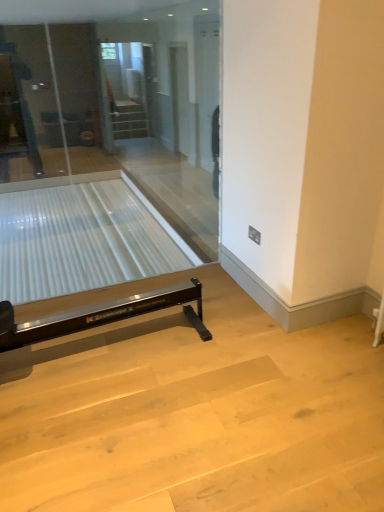
Measure the distance between transparent glass door at center and camera.

A distance of 4.11 meters exists between transparent glass door at center and camera.

Describe the element at coordinates (82, 238) in the screenshot. This screenshot has width=384, height=512. I see `clear glass table at lower left` at that location.

Locate an element on the screen. The height and width of the screenshot is (512, 384). transparent glass door at center is located at coordinates (107, 148).

Considering the sizes of objects transparent glass door at center and clear glass table at lower left in the image provided, who is taller, transparent glass door at center or clear glass table at lower left?

Standing taller between the two is transparent glass door at center.

Does point (123, 105) lie in front of point (176, 263)?

No, it is behind (176, 263).

From a real-world perspective, relative to clear glass table at lower left, is transparent glass door at center vertically above or below?

Clearly, from a real-world perspective, transparent glass door at center is above clear glass table at lower left.

Where is `glass door above the clear glass table at lower left (from the image's perspective)`? This screenshot has height=512, width=384. glass door above the clear glass table at lower left (from the image's perspective) is located at coordinates (107, 148).

Which is closer, (147, 117) or (199, 102)?

Point (147, 117) is positioned farther from the camera compared to point (199, 102).

Is clear glass screen door at upper center further to camera compared to transparent glass door at center?

Yes, it is behind transparent glass door at center.

Is clear glass screen door at upper center facing away from transparent glass door at center?

clear glass screen door at upper center is not turned away from transparent glass door at center.

From a real-world perspective, which is physically above, clear glass screen door at upper center or transparent glass door at center?

transparent glass door at center.

Does clear glass screen door at upper center have a greater width compared to clear glass table at lower left?

No.

How distant is clear glass screen door at upper center from clear glass table at lower left?

A distance of 8.60 feet exists between clear glass screen door at upper center and clear glass table at lower left.

Considering the positions of objects clear glass screen door at upper center and clear glass table at lower left in the image provided, who is more to the right, clear glass screen door at upper center or clear glass table at lower left?

clear glass screen door at upper center.

From a real-world perspective, is clear glass screen door at upper center physically located above or below clear glass table at lower left?

From a real-world perspective, clear glass screen door at upper center is physically above clear glass table at lower left.

From a real-world perspective, is clear glass table at lower left positioned above or below transparent glass door at center?

Clearly, from a real-world perspective, clear glass table at lower left is below transparent glass door at center.

Is clear glass table at lower left with transparent glass door at center?

No, clear glass table at lower left is not touching transparent glass door at center.

Which object is more forward, clear glass table at lower left or transparent glass door at center?

Positioned in front is transparent glass door at center.

Considering the relative positions of clear glass table at lower left and transparent glass door at center in the image provided, is clear glass table at lower left to the left of transparent glass door at center from the viewer's perspective?

Correct, you'll find clear glass table at lower left to the left of transparent glass door at center.

Consider the image. Is clear glass table at lower left aimed at clear glass screen door at upper center?

No, clear glass table at lower left is not facing towards clear glass screen door at upper center.

From the image's perspective, which is below, clear glass table at lower left or clear glass screen door at upper center?

clear glass table at lower left is shown below in the image.

You are a GUI agent. You are given a task and a screenshot of the screen. Output one action in this format:
    pyautogui.click(x=<x>, y=<y>)
    Task: Click on the glass table lying on the left of clear glass screen door at upper center
    The width and height of the screenshot is (384, 512).
    Given the screenshot: What is the action you would take?
    pyautogui.click(x=82, y=238)

Is transparent glass door at center in front of or behind clear glass screen door at upper center in the image?

In the image, transparent glass door at center appears in front of clear glass screen door at upper center.

Is transparent glass door at center in contact with clear glass screen door at upper center?

There is a gap between transparent glass door at center and clear glass screen door at upper center.

Would you say transparent glass door at center is inside or outside clear glass screen door at upper center?

transparent glass door at center is not inside clear glass screen door at upper center, it's outside.

Can you confirm if transparent glass door at center is taller than clear glass screen door at upper center?

No, transparent glass door at center is not taller than clear glass screen door at upper center.

Identify the location of glass table behind the transparent glass door at center. The width and height of the screenshot is (384, 512). pos(82,238).

I want to click on screen door that is under the transparent glass door at center (from a real-world perspective), so click(128, 89).

When comparing their distances from clear glass screen door at upper center, does clear glass table at lower left or transparent glass door at center seem closer?

clear glass table at lower left.

Estimate the real-world distances between objects in this image. Which object is further from clear glass table at lower left, clear glass screen door at upper center or transparent glass door at center?

The object further to clear glass table at lower left is clear glass screen door at upper center.

From the picture: Considering their positions, is transparent glass door at center positioned further to clear glass table at lower left than clear glass screen door at upper center?

clear glass screen door at upper center is further to clear glass table at lower left.

Consider the image. Based on their spatial positions, is clear glass screen door at upper center or clear glass table at lower left closer to transparent glass door at center?

Based on the image, clear glass table at lower left appears to be nearer to transparent glass door at center.

From the picture: When comparing their distances from clear glass screen door at upper center, does transparent glass door at center or clear glass table at lower left seem closer?

clear glass table at lower left lies closer to clear glass screen door at upper center than the other object.

Which object lies nearer to the anchor point transparent glass door at center, clear glass table at lower left or clear glass screen door at upper center?

clear glass table at lower left lies closer to transparent glass door at center than the other object.

Where is `glass table positioned between transparent glass door at center and clear glass screen door at upper center from near to far`? Image resolution: width=384 pixels, height=512 pixels. glass table positioned between transparent glass door at center and clear glass screen door at upper center from near to far is located at coordinates pyautogui.click(x=82, y=238).